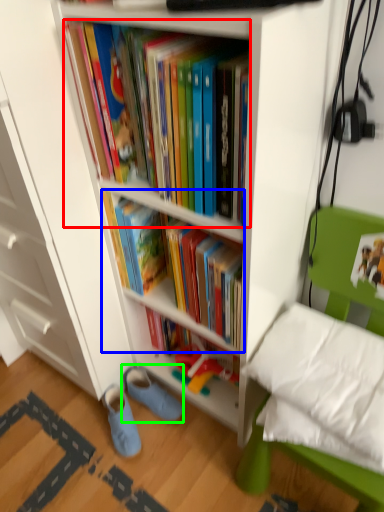
Question: Which is farther away from book (highlighted by a red box)? book (highlighted by a blue box) or footwear (highlighted by a green box)?

Choices:
 (A) book
 (B) footwear

Answer: (B)